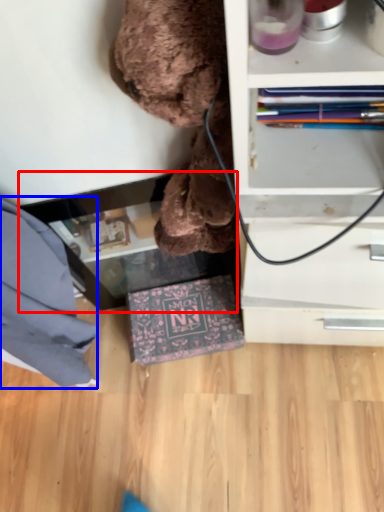
Question: Which point is further to the camera, table (highlighted by a red box) or clothe (highlighted by a blue box)?

Choices:
 (A) table
 (B) clothe

Answer: (A)